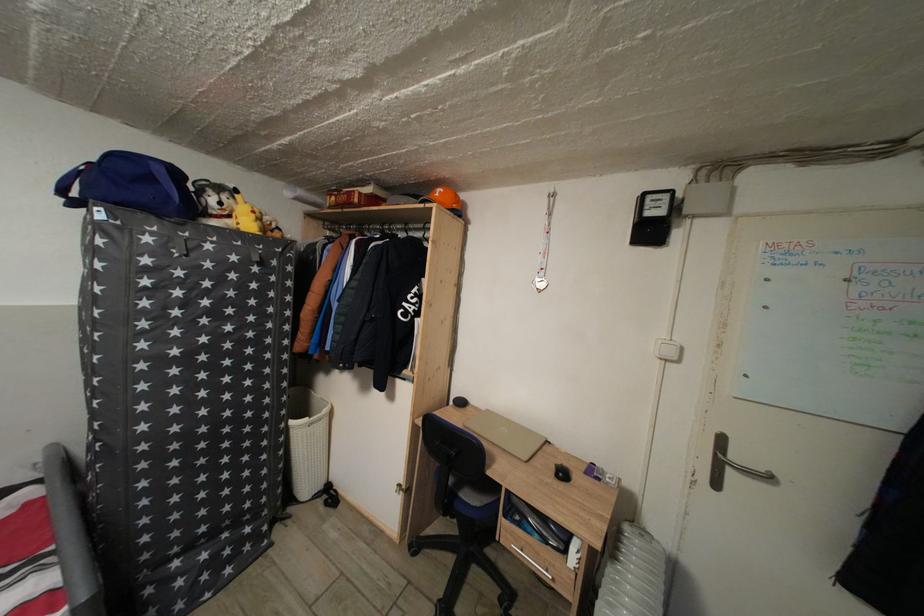
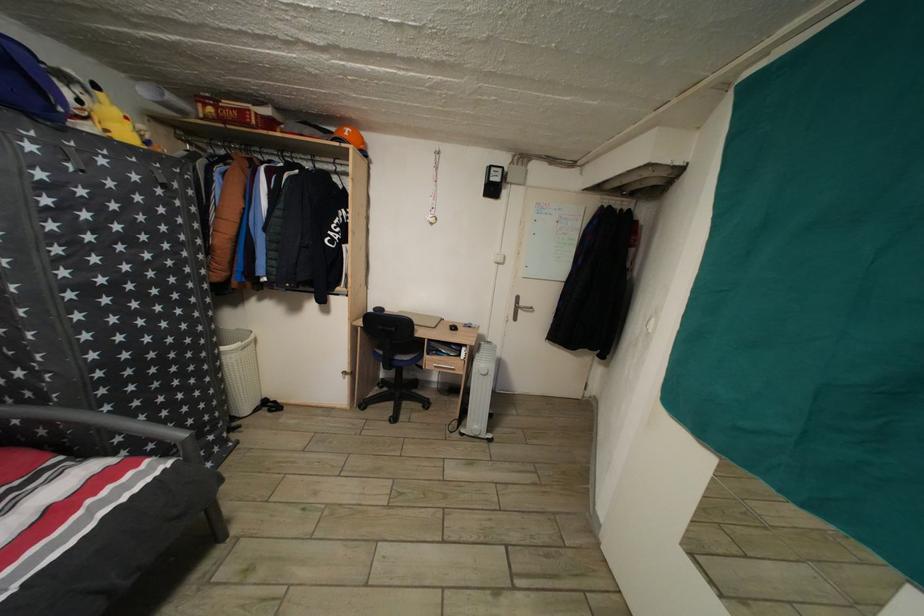
In the second image, find the point that corresponds to (x=261, y=217) in the first image.

(134, 124)